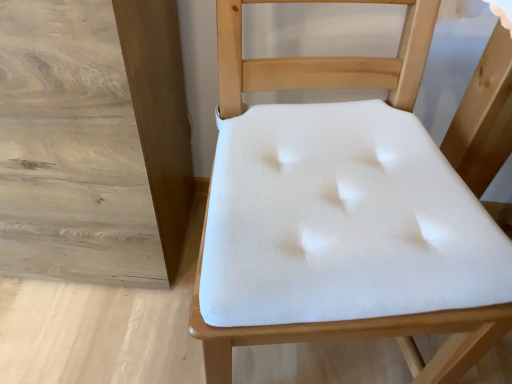
Find the location of a particular element. Image resolution: width=512 pixels, height=384 pixels. white fabric cushion at center is located at coordinates (323, 60).

Measure the distance between white fabric cushion at center and camera.

white fabric cushion at center is 24.25 inches from camera.

What do you see at coordinates (323, 60) in the screenshot? I see `white fabric cushion at center` at bounding box center [323, 60].

I want to click on white fabric cushion at center, so click(x=323, y=60).